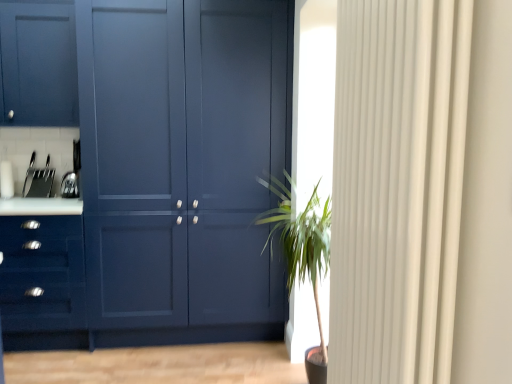
The width and height of the screenshot is (512, 384). Describe the element at coordinates (70, 185) in the screenshot. I see `satin silver toaster at left` at that location.

Where is `white textured curtain at right`? This screenshot has height=384, width=512. white textured curtain at right is located at coordinates (397, 187).

Where is `matte blue cabinet at center`? matte blue cabinet at center is located at coordinates (152, 174).

This screenshot has width=512, height=384. Describe the element at coordinates (42, 273) in the screenshot. I see `matte blue drawer at left` at that location.

Where is `satin silver toaster at left`? satin silver toaster at left is located at coordinates (70, 185).

From the image's perspective, is matte blue drawer at left on top of matte blue cabinet at center?

No, from the image's perspective, matte blue drawer at left is not on top of matte blue cabinet at center.

Is there a large distance between matte blue drawer at left and matte blue cabinet at center?

They are positioned close to each other.

Does matte blue drawer at left turn towards matte blue cabinet at center?

No, matte blue drawer at left is not turned towards matte blue cabinet at center.

Relative to matte blue cabinet at center, is matte blue drawer at left in front or behind?

Clearly, matte blue drawer at left is behind matte blue cabinet at center.

From the picture: From the image's perspective, is white textured curtain at right below matte blue drawer at left?

Actually, white textured curtain at right appears above matte blue drawer at left in the image.

Where is `curtain on the right of matte blue drawer at left`? curtain on the right of matte blue drawer at left is located at coordinates (397, 187).

Considering the sizes of white textured curtain at right and matte blue drawer at left in the image, is white textured curtain at right taller or shorter than matte blue drawer at left?

Considering their sizes, white textured curtain at right has more height than matte blue drawer at left.

Which object is positioned more to the left, white textured curtain at right or matte blue drawer at left?

Positioned to the left is matte blue drawer at left.

Identify the location of houseplant that is on the right side of satin silver toaster at left. (302, 255).

How different are the orientations of green leafy plant at center and satin silver toaster at left in degrees?

The facing directions of green leafy plant at center and satin silver toaster at left are 90.1 degrees apart.

Is green leafy plant at center shorter than satin silver toaster at left?

Incorrect, the height of green leafy plant at center does not fall short of that of satin silver toaster at left.

Could satin silver toaster at left be considered to be inside green leafy plant at center?

No, satin silver toaster at left is located outside of green leafy plant at center.

Considering their positions, is matte blue drawer at left located in front of or behind white textured curtain at right?

matte blue drawer at left is positioned farther from the viewer than white textured curtain at right.

What's the angular difference between matte blue drawer at left and white textured curtain at right's facing directions?

92.1 degrees.

From the image's perspective, is matte blue drawer at left located above white textured curtain at right?

No.

Is matte blue drawer at left outside of white textured curtain at right?

Indeed, matte blue drawer at left is completely outside white textured curtain at right.

Which is farther from the camera, (x=109, y=334) or (x=14, y=297)?

The point (x=109, y=334) is farther from the camera.

Considering the relative sizes of matte blue cabinet at center and matte blue drawer at left in the image provided, is matte blue cabinet at center thinner than matte blue drawer at left?

Incorrect, the width of matte blue cabinet at center is not less than that of matte blue drawer at left.

From the picture: Can you confirm if matte blue cabinet at center is shorter than matte blue drawer at left?

No, matte blue cabinet at center is not shorter than matte blue drawer at left.

The height and width of the screenshot is (384, 512). Identify the location of cupboard above the white textured curtain at right (from the image's perspective). (152, 174).

How much distance is there between white textured curtain at right and matte blue cabinet at center?

white textured curtain at right is 5.41 feet from matte blue cabinet at center.

From the image's perspective, between white textured curtain at right and matte blue cabinet at center, which one is located above?

matte blue cabinet at center is shown above in the image.

From a real-world perspective, between white textured curtain at right and matte blue cabinet at center, who is vertically lower?

In real-world perspective, matte blue cabinet at center is lower.

Based on the photo, can you confirm if green leafy plant at center is taller than matte blue drawer at left?

Correct, green leafy plant at center is much taller as matte blue drawer at left.

Is green leafy plant at center to the left of matte blue drawer at left from the viewer's perspective?

No, green leafy plant at center is not to the left of matte blue drawer at left.

Which is closer, (310,218) or (53,312)?

Point (310,218)

At what (x,y) coordinates should I click in order to perform the action: click on drawer below the matte blue cabinet at center (from the image's perspective). Please return your answer as a coordinate pair (x, y). This screenshot has width=512, height=384. Looking at the image, I should click on (42, 273).

The image size is (512, 384). I want to click on drawer that appears on the left of white textured curtain at right, so click(x=42, y=273).

Estimate the real-world distances between objects in this image. Which object is closer to matte blue cabinet at center, satin silver toaster at left or green leafy plant at center?

The object closer to matte blue cabinet at center is green leafy plant at center.

Which object lies further to the anchor point green leafy plant at center, white textured curtain at right or matte blue cabinet at center?

Among the two, white textured curtain at right is located further to green leafy plant at center.

Considering their positions, is satin silver toaster at left positioned closer to white textured curtain at right than matte blue drawer at left?

The object closer to white textured curtain at right is matte blue drawer at left.

When comparing their distances from green leafy plant at center, does satin silver toaster at left or matte blue cabinet at center seem further?

satin silver toaster at left is positioned further to the anchor green leafy plant at center.

From the image, which object appears to be farther from white textured curtain at right, satin silver toaster at left or green leafy plant at center?

The object further to white textured curtain at right is satin silver toaster at left.

Looking at the image, which one is located closer to matte blue cabinet at center, satin silver toaster at left or matte blue drawer at left?

matte blue drawer at left lies closer to matte blue cabinet at center than the other object.

Based on their spatial positions, is matte blue cabinet at center or satin silver toaster at left further from green leafy plant at center?

satin silver toaster at left is further to green leafy plant at center.

Looking at the image, which one is located further to matte blue cabinet at center, matte blue drawer at left or white textured curtain at right?

The object further to matte blue cabinet at center is white textured curtain at right.

I want to click on cupboard between white textured curtain at right and matte blue drawer at left from front to back, so pos(152,174).

You are a GUI agent. You are given a task and a screenshot of the screen. Output one action in this format:
    pyautogui.click(x=<x>, y=<y>)
    Task: Click on the appliance located between matte blue drawer at left and matte blue cabinet at center in the left-right direction
    The image size is (512, 384).
    Given the screenshot: What is the action you would take?
    pyautogui.click(x=70, y=185)

At what (x,y) coordinates should I click in order to perform the action: click on cupboard between white textured curtain at right and satin silver toaster at left along the z-axis. Please return your answer as a coordinate pair (x, y). The image size is (512, 384). Looking at the image, I should click on (152, 174).

The image size is (512, 384). In order to click on houseplant located between white textured curtain at right and satin silver toaster at left in the depth direction in this screenshot , I will do `click(302, 255)`.